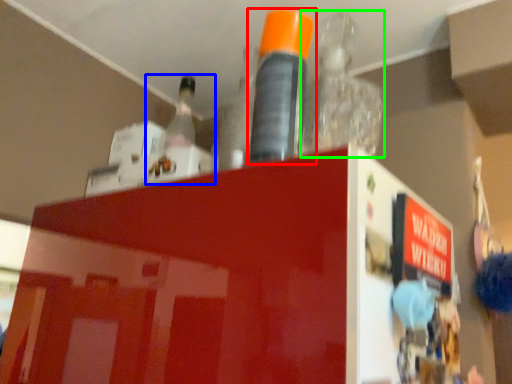
Question: Considering the real-world distances, which object is farthest from bottle (highlighted by a red box)? bottle (highlighted by a blue box) or bottle (highlighted by a green box)?

Choices:
 (A) bottle
 (B) bottle

Answer: (A)